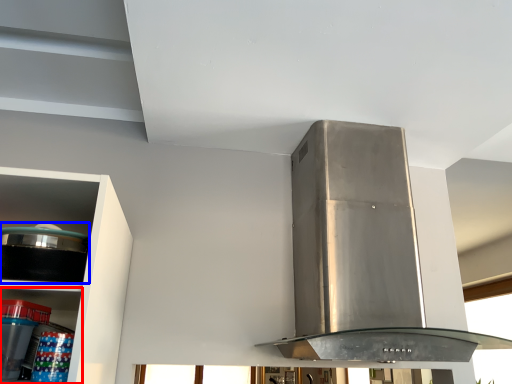
Question: Among these objects, which one is nearest to the camera, shelf (highlighted by a red box) or appliance (highlighted by a blue box)?

Choices:
 (A) shelf
 (B) appliance

Answer: (B)